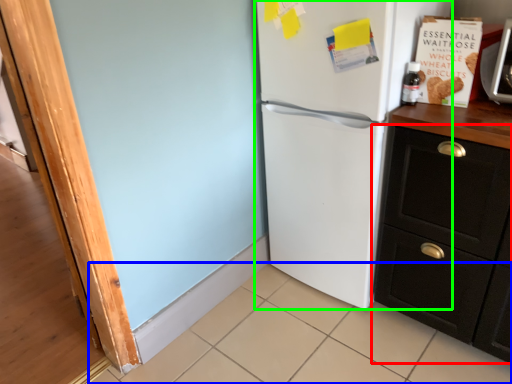
Question: Considering the real-world distances, which object is closest to cabinetry (highlighted by a red box)? tile (highlighted by a blue box) or refrigerator (highlighted by a green box).

Choices:
 (A) tile
 (B) refrigerator

Answer: (B)